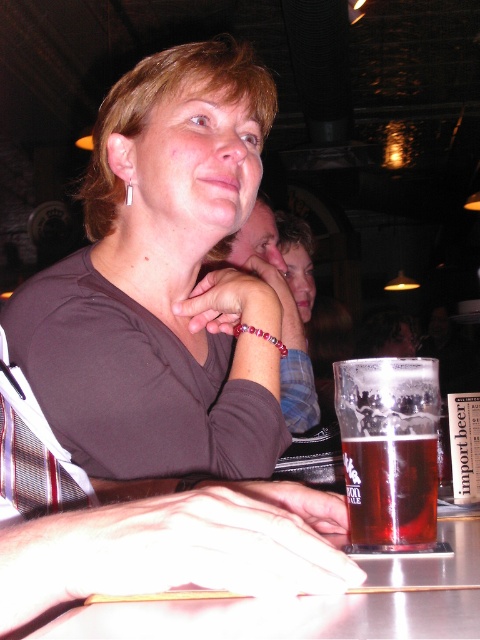
You are a customer in a bar and want to place your phone on the metallic silver table at lower center. However, there is a matte blue shirt at center in the way. To reach the table, should you move to your left or right?

The metallic silver table at lower center is to the right of the matte blue shirt at center, so you should move to your right to reach the table.

You are a fashion designer observing the scene. You notice two shirts in the image, the matte brown shirt at center and the matte blue shirt at center. Which one is positioned lower on the person?

The matte brown shirt at center is located below the matte blue shirt at center, so the matte brown shirt at center is positioned lower on the person.